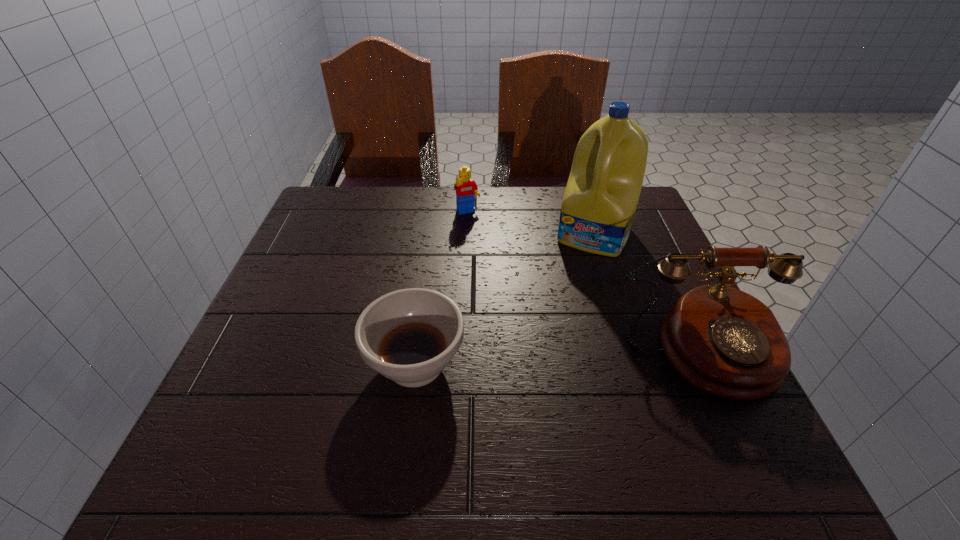
This screenshot has width=960, height=540. What are the coordinates of `vacant space on the desktop that is between the shortest object and the second tallest object and is positioned on the label of the detergent` in the screenshot? It's located at (539, 359).

Identify the location of vacant spot on the desktop that is between the shortest object and the third shortest object and is positioned on the face of the third tallest object. (554, 359).